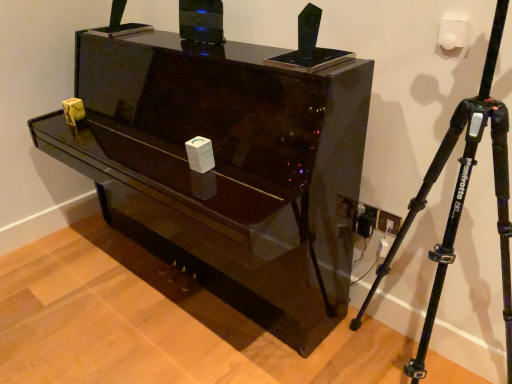
Question: Considering the relative sizes of glossy black piano at center and black matte tripod at right in the image provided, is glossy black piano at center taller than black matte tripod at right?

Choices:
 (A) no
 (B) yes

Answer: (A)

Question: Does glossy black piano at center lie in front of black matte tripod at right?

Choices:
 (A) yes
 (B) no

Answer: (B)

Question: From a real-world perspective, does glossy black piano at center stand above black matte tripod at right?

Choices:
 (A) yes
 (B) no

Answer: (B)

Question: Is glossy black piano at center to the right of black matte tripod at right from the viewer's perspective?

Choices:
 (A) no
 (B) yes

Answer: (A)

Question: Considering the relative sizes of glossy black piano at center and black matte tripod at right in the image provided, is glossy black piano at center wider than black matte tripod at right?

Choices:
 (A) yes
 (B) no

Answer: (A)

Question: Can you confirm if glossy black piano at center is shorter than black matte tripod at right?

Choices:
 (A) no
 (B) yes

Answer: (B)

Question: From a real-world perspective, is black matte tripod at right physically below glossy black piano at center?

Choices:
 (A) no
 (B) yes

Answer: (A)

Question: Would you say black matte tripod at right contains glossy black piano at center?

Choices:
 (A) no
 (B) yes

Answer: (A)

Question: Is black matte tripod at right located outside glossy black piano at center?

Choices:
 (A) yes
 (B) no

Answer: (A)

Question: Does black matte tripod at right have a greater width compared to glossy black piano at center?

Choices:
 (A) no
 (B) yes

Answer: (A)

Question: From the image's perspective, is black matte tripod at right under glossy black piano at center?

Choices:
 (A) no
 (B) yes

Answer: (B)

Question: Is glossy black piano at center at the back of black matte tripod at right?

Choices:
 (A) yes
 (B) no

Answer: (B)

Question: From their relative heights in the image, would you say black matte tripod at right is taller or shorter than glossy black piano at center?

Choices:
 (A) tall
 (B) short

Answer: (A)